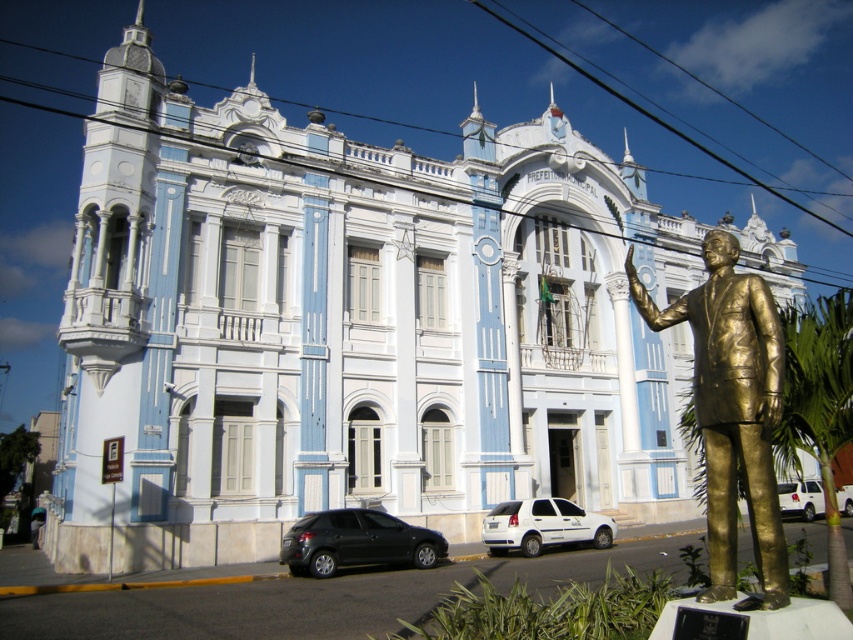
Between point (727, 404) and point (842, 493), which one is positioned behind?

The point (842, 493) is behind.

Can you confirm if gold-bronze statue at right is thinner than white matte car at lower right?

Yes, gold-bronze statue at right is thinner than white matte car at lower right.

Identify the location of gold-bronze statue at right. Image resolution: width=853 pixels, height=640 pixels. (732, 410).

Where is `gold-bronze statue at right`? gold-bronze statue at right is located at coordinates click(732, 410).

Between white matte car at lower right and metallic silver car at center, which one is positioned higher?

white matte car at lower right is higher up.

Between white matte car at lower right and metallic silver car at center, which one appears on the left side from the viewer's perspective?

From the viewer's perspective, white matte car at lower right appears more on the left side.

Find the location of a particular element. white matte car at lower right is located at coordinates (801, 499).

I want to click on white matte car at lower right, so click(801, 499).

Is white matte car at center bigger than metallic silver car at center?

Indeed, white matte car at center has a larger size compared to metallic silver car at center.

Can you confirm if white matte car at center is positioned above metallic silver car at center?

Yes.

At what (x,y) coordinates should I click in order to perform the action: click on white matte car at center. Please return your answer as a coordinate pair (x, y). This screenshot has height=640, width=853. Looking at the image, I should click on (543, 525).